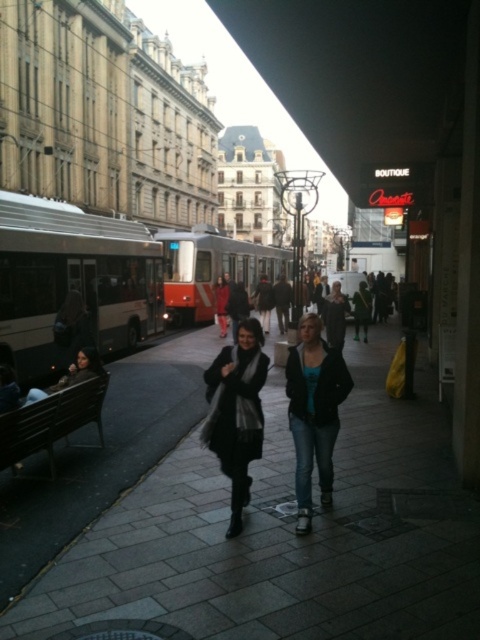
You are a fashion designer observing a busy street scene. You notice two items of clothing at the center of the image. The jeans at center and the black wool scarf at center. Can you determine if the distance between them is sufficient to allow a 50 cm wide mannequin to stand between them without touching either item?

The distance between the jeans at center and the black wool scarf at center is 63.78 centimeters. Since the mannequin is 50 cm wide, there is enough space for it to fit between them without touching either item.

You are a pedestrian standing on the dark gray paving stones at center and want to pick up the black wool scarf at center. Which direction should you move to reach it?

The dark gray paving stones at center is positioned on the right side of the black wool scarf at center, so you should move to your left to reach it.